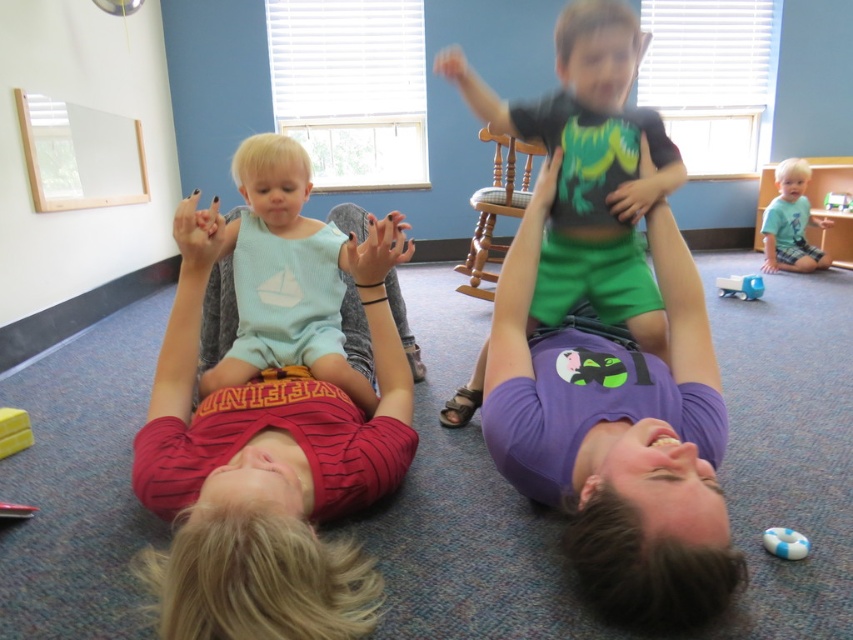
This screenshot has width=853, height=640. Describe the element at coordinates (790, 221) in the screenshot. I see `light blue cotton shirt at lower right` at that location.

Between point (793, 170) and point (741, 278), which one is positioned behind?

Point (793, 170)

The width and height of the screenshot is (853, 640). What are the coordinates of `light blue cotton shirt at lower right` in the screenshot? It's located at (790, 221).

Based on the photo, between light blue jersey at center and blue plastic toy car at center, which one appears on the left side from the viewer's perspective?

light blue jersey at center is more to the left.

Is light blue jersey at center thinner than blue plastic toy car at center?

No.

Is point (250, 339) positioned after point (735, 296)?

No, (250, 339) is in front of (735, 296).

Image resolution: width=853 pixels, height=640 pixels. What are the coordinates of `light blue jersey at center` in the screenshot? It's located at (283, 276).

Does light blue jersey at center have a greater height compared to light blue cotton shirt at lower right?

Incorrect, light blue jersey at center's height is not larger of light blue cotton shirt at lower right's.

Does light blue jersey at center appear over light blue cotton shirt at lower right?

No.

Who is more distant from viewer, (352, 401) or (804, 161)?

Point (804, 161)

I want to click on light blue jersey at center, so click(283, 276).